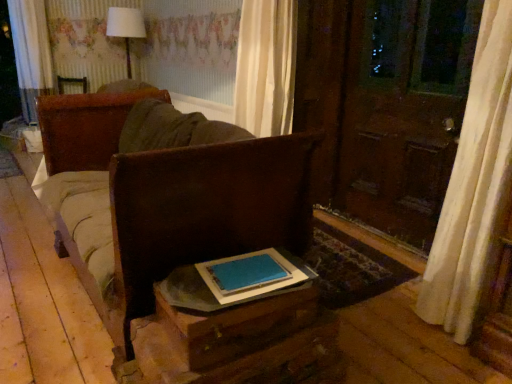
Question: Can you confirm if blue matte book at center is thinner than wooden table at lower center?

Choices:
 (A) no
 (B) yes

Answer: (B)

Question: From a real-world perspective, is blue matte book at center positioned over wooden table at lower center based on gravity?

Choices:
 (A) no
 (B) yes

Answer: (B)

Question: Is blue matte book at center looking in the opposite direction of wooden table at lower center?

Choices:
 (A) no
 (B) yes

Answer: (B)

Question: From the image's perspective, is blue matte book at center below wooden table at lower center?

Choices:
 (A) no
 (B) yes

Answer: (A)

Question: Is blue matte book at center facing towards wooden table at lower center?

Choices:
 (A) yes
 (B) no

Answer: (A)

Question: Do you think blue matte book at center is within brown leather couch at center, or outside of it?

Choices:
 (A) inside
 (B) outside

Answer: (B)

Question: Relative to brown leather couch at center, is blue matte book at center in front or behind?

Choices:
 (A) front
 (B) behind

Answer: (B)

Question: Considering the relative positions of blue matte book at center and brown leather couch at center in the image provided, is blue matte book at center to the left or to the right of brown leather couch at center?

Choices:
 (A) right
 (B) left

Answer: (A)

Question: Is point (245, 259) positioned closer to the camera than point (202, 205)?

Choices:
 (A) farther
 (B) closer

Answer: (B)

Question: From the image's perspective, is blue matte book at center positioned above or below white fabric lampshade at upper center?

Choices:
 (A) below
 (B) above

Answer: (A)

Question: Looking at their shapes, would you say blue matte book at center is wider or thinner than white fabric lampshade at upper center?

Choices:
 (A) thin
 (B) wide

Answer: (A)

Question: From their relative heights in the image, would you say blue matte book at center is taller or shorter than white fabric lampshade at upper center?

Choices:
 (A) tall
 (B) short

Answer: (B)

Question: Is blue matte book at center inside the boundaries of white fabric lampshade at upper center, or outside?

Choices:
 (A) outside
 (B) inside

Answer: (A)

Question: Considering their positions, is brown leather couch at center located in front of or behind white fabric lampshade at upper center?

Choices:
 (A) front
 (B) behind

Answer: (A)

Question: Is brown leather couch at center wider or thinner than white fabric lampshade at upper center?

Choices:
 (A) wide
 (B) thin

Answer: (A)